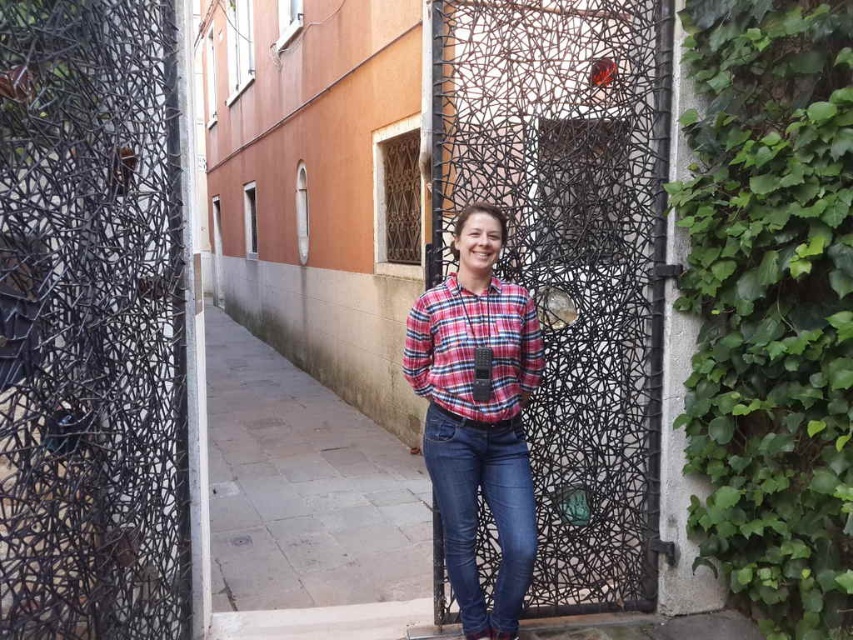
Based on the photo, you are a delivery person needing to pass through the entrance shown. The black wire mesh at center and the black textured door at center are both in your path. According to the scene, which object should you move around to the right side to proceed?

You should move around to the right side of the black wire mesh at center because it is positioned to the left of the black textured door at center, meaning the door is on the right side of the mesh. By moving to the right of the mesh, you can access the door and proceed through the entrance.

You are standing in front of the artistic gate and want to determine the relative positions of two points marked on the gate. Which point is closer to you, the point at coordinates point (x=303, y=413) or point (x=498, y=413)?

The point at coordinates point (x=303, y=413) is closer to you because it is further to the viewer than point (x=498, y=413).